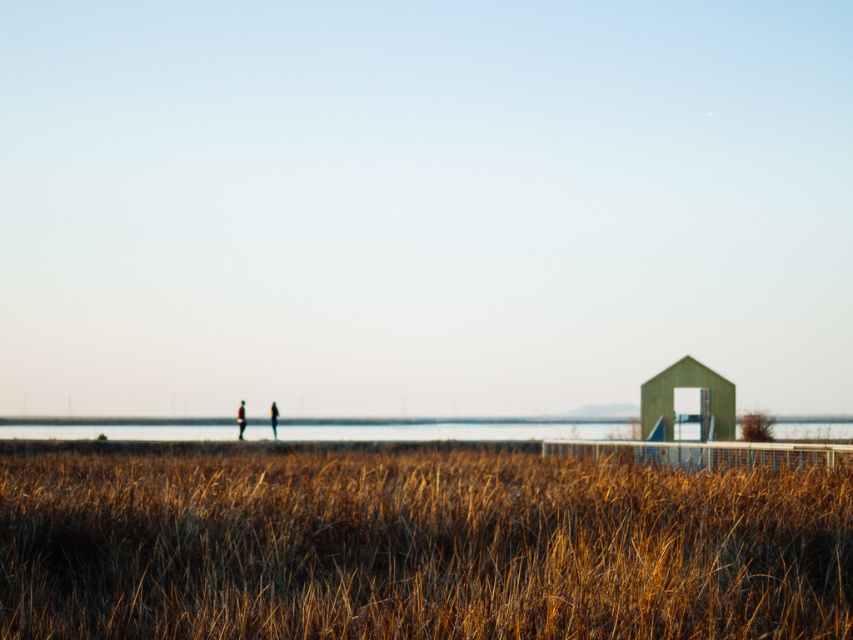
Question: Can you confirm if clear water at center is positioned to the left of matte brown jacket at center?

Choices:
 (A) yes
 (B) no

Answer: (B)

Question: Is brown dry grass at lower center wider than matte black person at center?

Choices:
 (A) yes
 (B) no

Answer: (A)

Question: Can you confirm if matte brown jacket at center is wider than matte black person at center?

Choices:
 (A) no
 (B) yes

Answer: (B)

Question: Which object is closer to the camera taking this photo?

Choices:
 (A) matte black person at center
 (B) matte brown jacket at center
 (C) brown dry grass at lower center

Answer: (C)

Question: Which object appears farthest from the camera in this image?

Choices:
 (A) matte black person at center
 (B) clear water at center
 (C) brown dry grass at lower center
 (D) matte brown jacket at center

Answer: (A)

Question: Which object is closer to the camera taking this photo?

Choices:
 (A) brown dry grass at lower center
 (B) matte black person at center
 (C) matte brown jacket at center
 (D) clear water at center

Answer: (A)